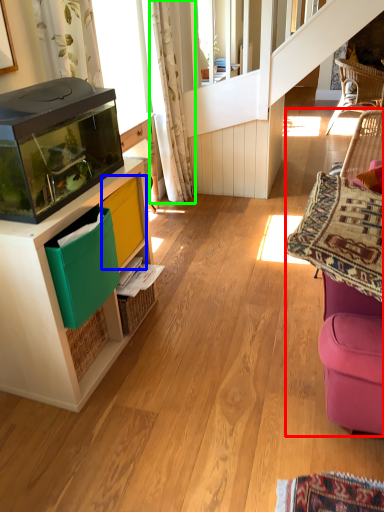
Question: Based on their relative distances, which object is farther from swivel chair (highlighted by a red box)? Choose from shelf (highlighted by a blue box) and curtain (highlighted by a green box).

Choices:
 (A) shelf
 (B) curtain

Answer: (B)